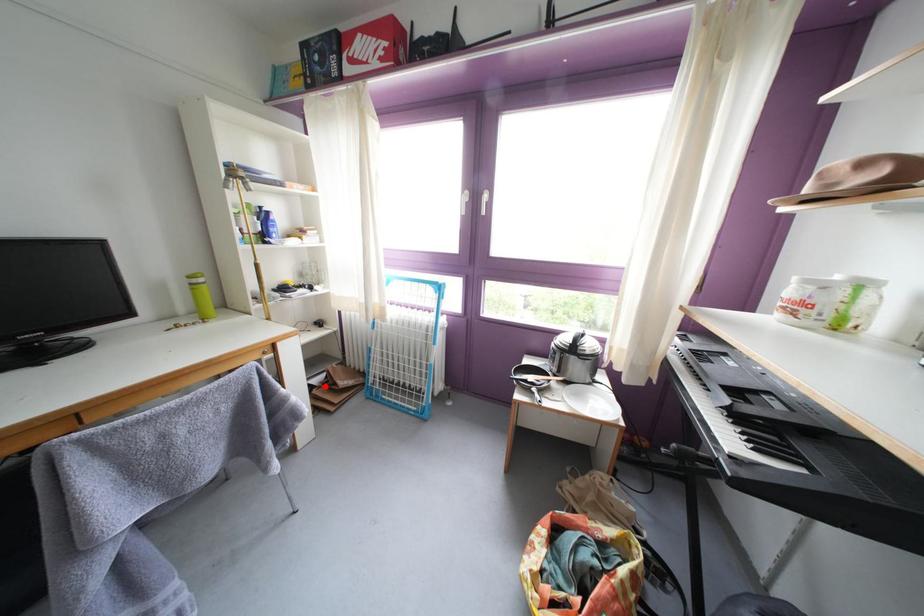
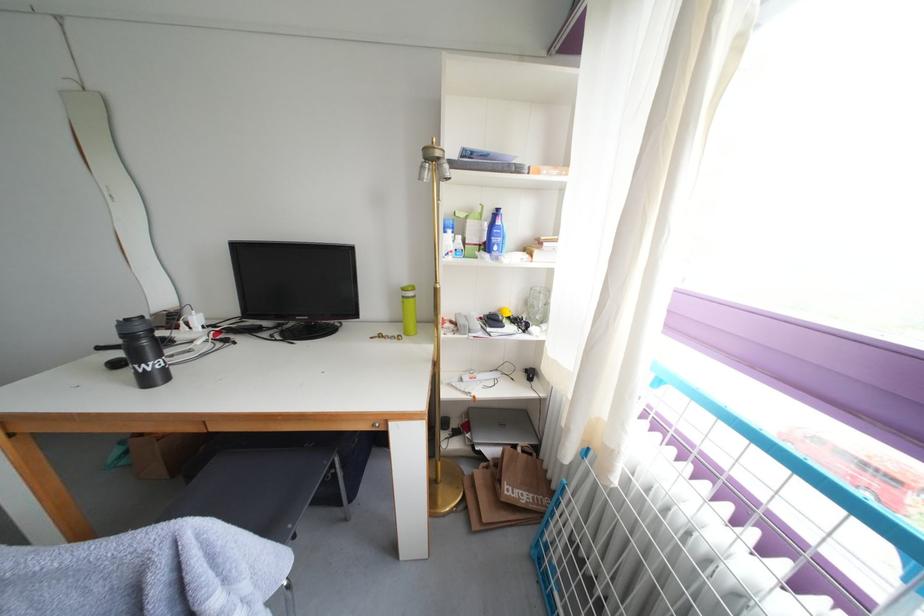
Question: I am providing you with two images of the same scene from different viewpoints. A red point is marked on the first image. Can you still see the location of the red point in image 2?

Choices:
 (A) Yes
 (B) No

Answer: (A)